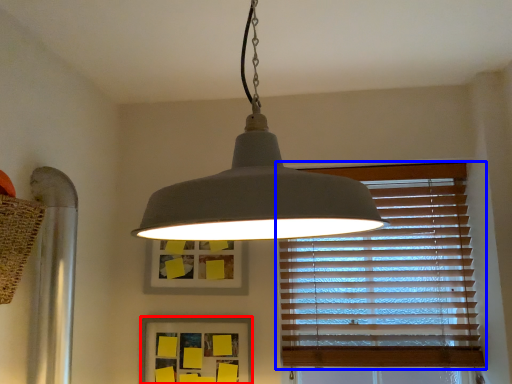
Question: Among these objects, which one is nearest to the camera, picture frame (highlighted by a red box) or window blind (highlighted by a blue box)?

Choices:
 (A) picture frame
 (B) window blind

Answer: (A)